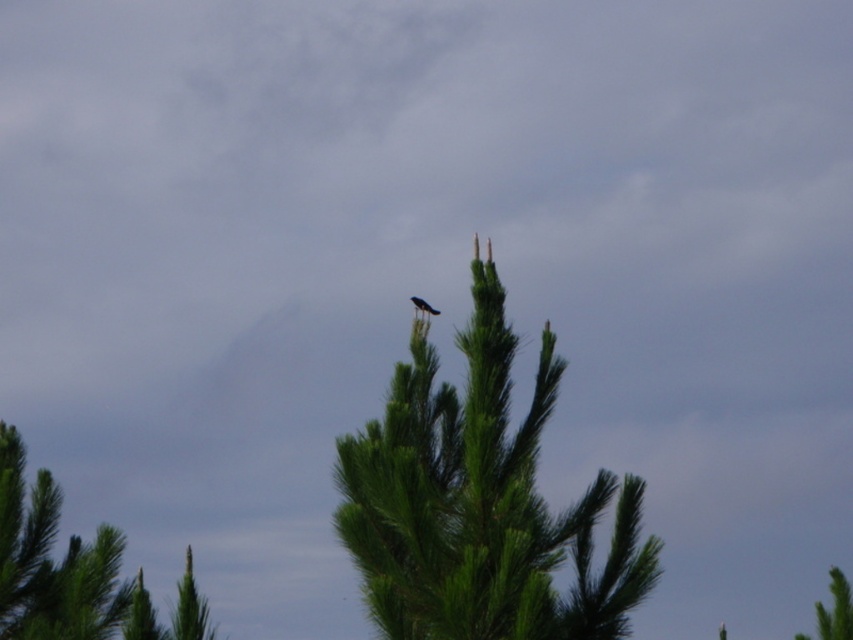
You are standing in the middle of a forest and see two points in the scene. The first point is at coordinate point (341, 458) and the second point is at point (419, 301). Which point is closer to you?

Point (341, 458) is closer to the camera than point (419, 301), so the first point is closer to you.